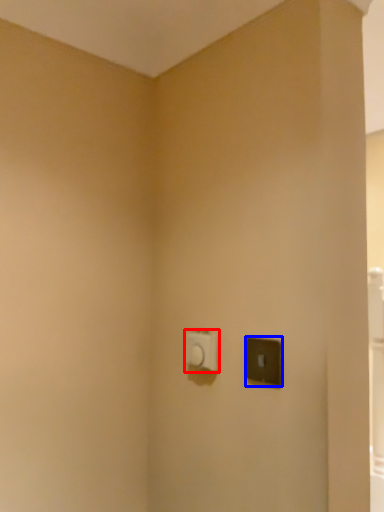
Question: Which of the following is the farthest to the observer, light switch (highlighted by a red box) or light switch (highlighted by a blue box)?

Choices:
 (A) light switch
 (B) light switch

Answer: (A)